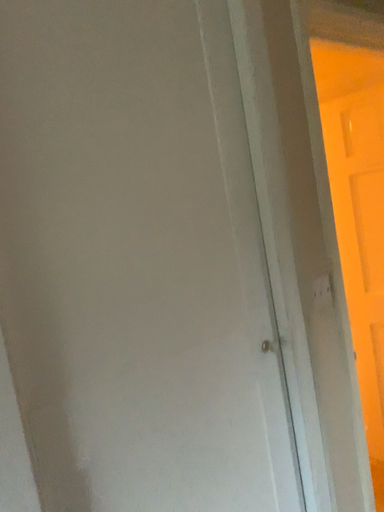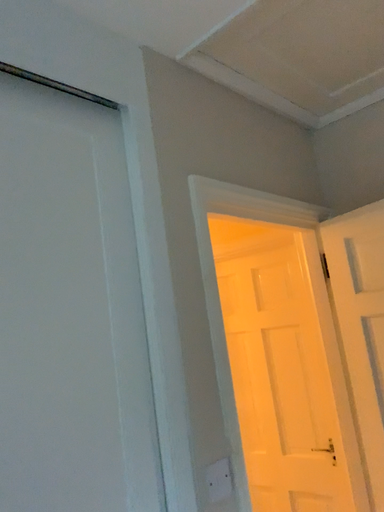
Question: How did the camera likely rotate when shooting the video?

Choices:
 (A) rotated downward
 (B) rotated upward

Answer: (B)